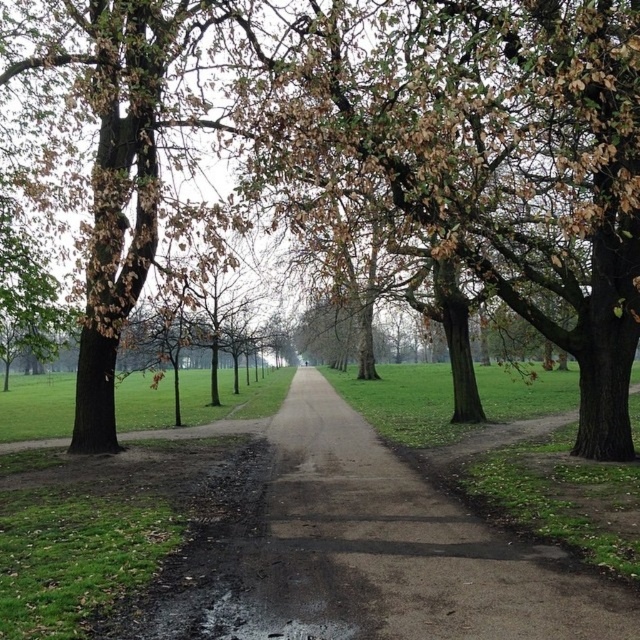
Question: In this image, where is green leafy tree at center located relative to dull brown dirt path at center?

Choices:
 (A) right
 (B) left

Answer: (A)

Question: Considering the relative positions of green leafy tree at center and dull brown dirt path at center in the image provided, where is green leafy tree at center located with respect to dull brown dirt path at center?

Choices:
 (A) right
 (B) left

Answer: (A)

Question: Which object appears farthest from the camera in this image?

Choices:
 (A) green leafy tree at center
 (B) dull brown dirt path at center

Answer: (A)

Question: Can you confirm if green leafy tree at center is smaller than dull brown dirt path at center?

Choices:
 (A) no
 (B) yes

Answer: (B)